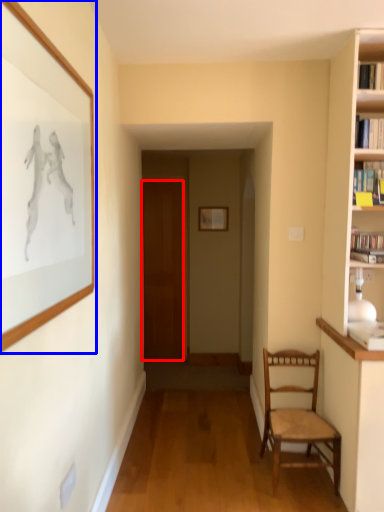
Question: Which object appears farthest to the camera in this image, door (highlighted by a red box) or picture frame (highlighted by a blue box)?

Choices:
 (A) door
 (B) picture frame

Answer: (A)